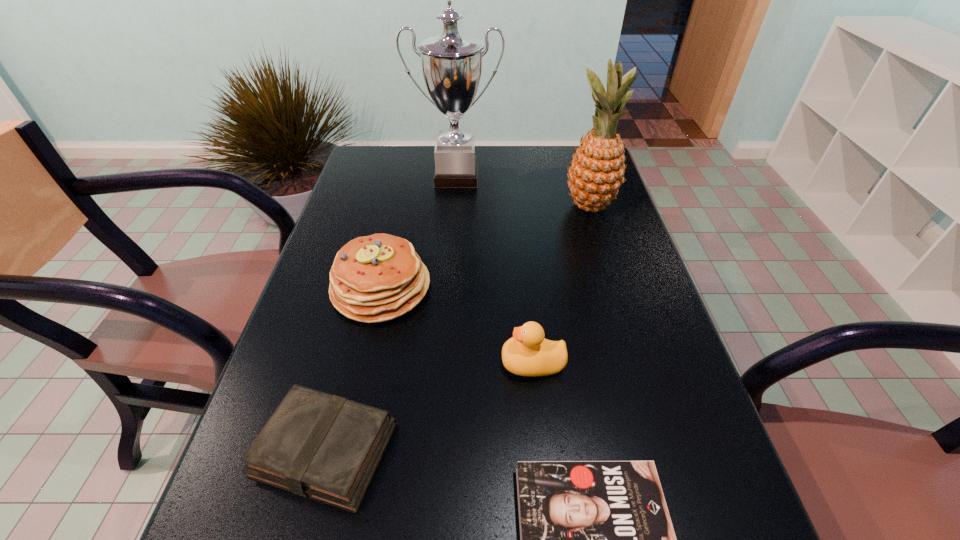
Where is `free point between the left book and the fourth farthest object`? The width and height of the screenshot is (960, 540). free point between the left book and the fourth farthest object is located at coordinates (429, 406).

Locate an element on the screen. The height and width of the screenshot is (540, 960). unoccupied area between the duck and the taller book is located at coordinates (429, 406).

Where is `free space between the tallest object and the pineapple`? The width and height of the screenshot is (960, 540). free space between the tallest object and the pineapple is located at coordinates (523, 191).

Locate an element on the screen. empty space that is in between the pineapple and the tallest object is located at coordinates (523, 191).

The height and width of the screenshot is (540, 960). In order to click on vacant space that's between the fourth nearest object and the tallest object in this screenshot , I will do `click(419, 232)`.

Identify the location of free space between the tallest object and the fourth farthest object. The image size is (960, 540). (494, 269).

In order to click on empty space between the pancake and the left book in this screenshot , I will do `click(353, 368)`.

Locate an element on the screen. Image resolution: width=960 pixels, height=540 pixels. object that is the third nearest to the tallest object is located at coordinates (527, 353).

At what (x,y) coordinates should I click in order to perform the action: click on the second closest object to the shorter book. Please return your answer as a coordinate pair (x, y). Looking at the image, I should click on (316, 445).

Locate an element on the screen. free space that satisfies the following two spatial constraints: 1. on the back side of the fifth tallest object; 2. on the right side of the pancake is located at coordinates (367, 288).